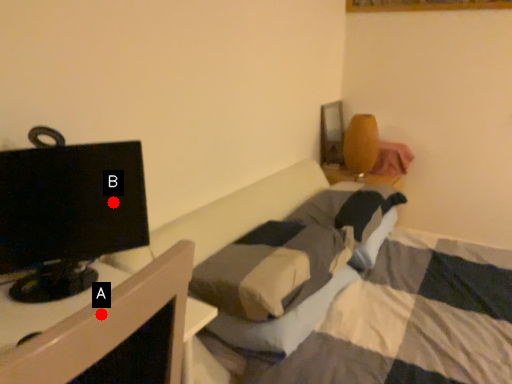
Question: Two points are circled on the image, labeled by A and B beside each circle. Among these points, which one is nearest to the camera?

Choices:
 (A) A is closer
 (B) B is closer

Answer: (A)